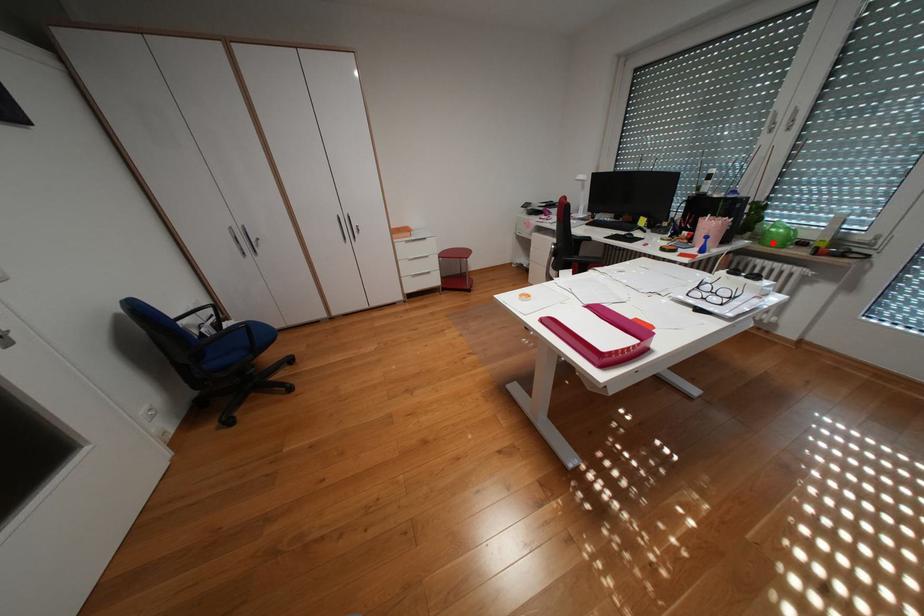
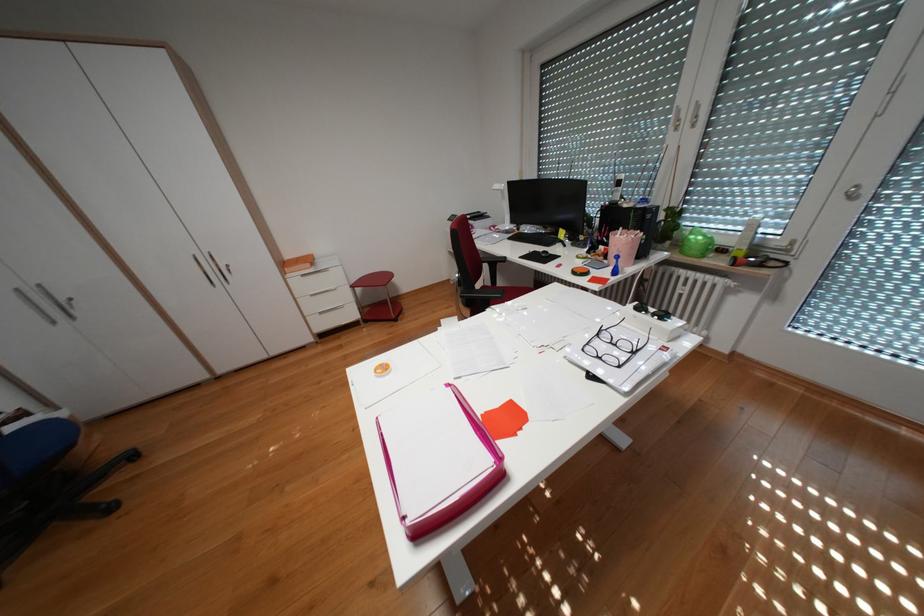
Locate, in the second image, the point that corresponds to the highlighted location in the first image.

(694, 252)